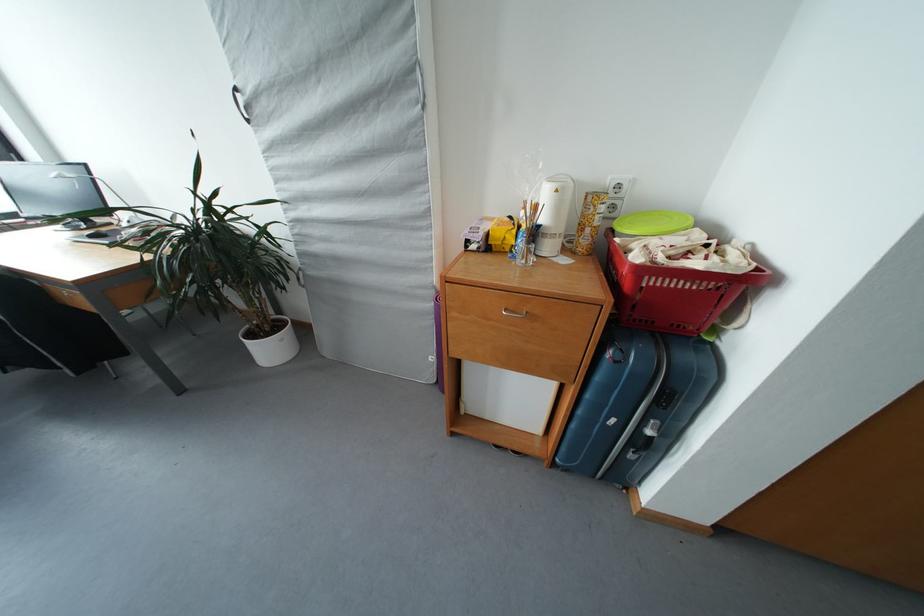
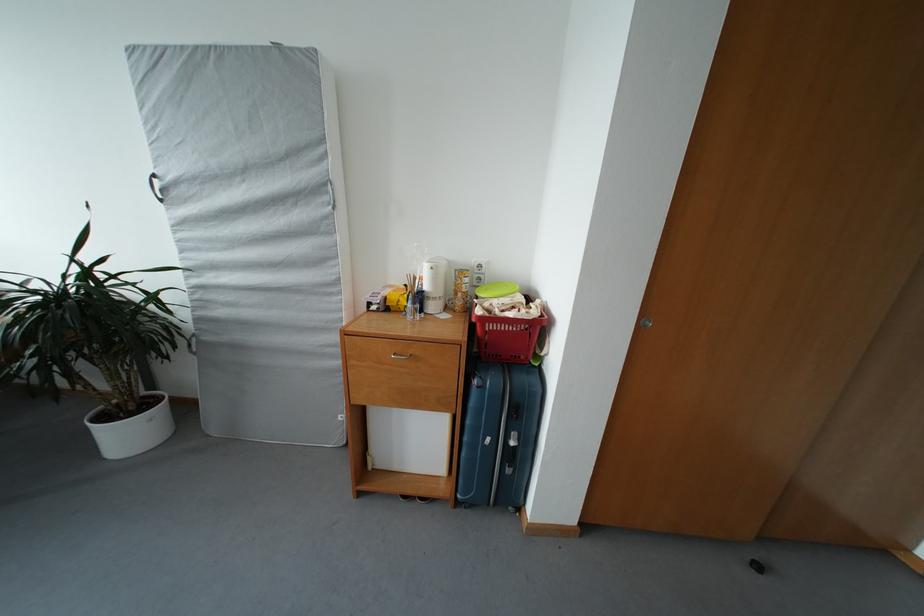
Find the pixel in the second image that matches (x=579, y=431) in the first image.

(469, 459)